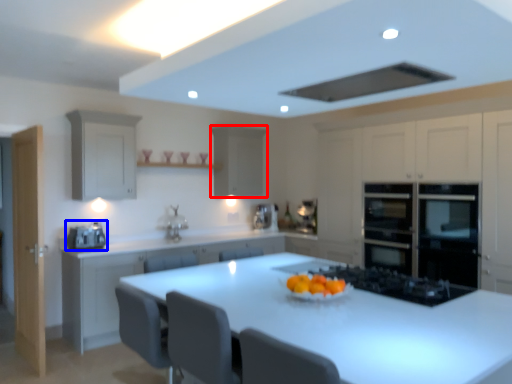
Question: Which object is further to the camera taking this photo, cabinetry (highlighted by a red box) or home appliance (highlighted by a blue box)?

Choices:
 (A) cabinetry
 (B) home appliance

Answer: (A)